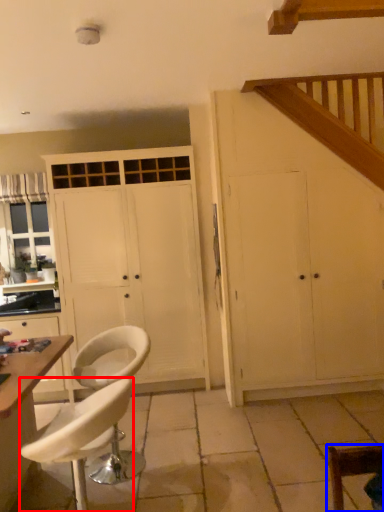
Question: Which object is further to the camera taking this photo, chair (highlighted by a red box) or chair (highlighted by a blue box)?

Choices:
 (A) chair
 (B) chair

Answer: (A)